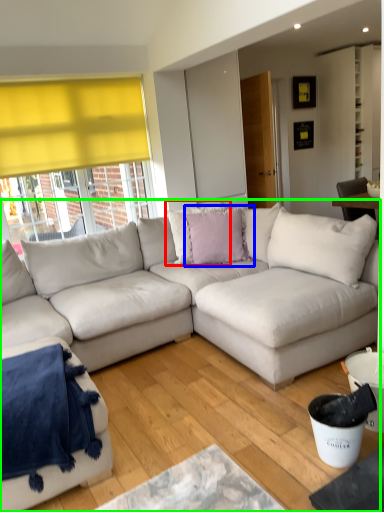
Question: Which is farther away from pillow (highlighted by a red box)? pillow (highlighted by a blue box) or studio couch (highlighted by a green box)?

Choices:
 (A) pillow
 (B) studio couch

Answer: (B)